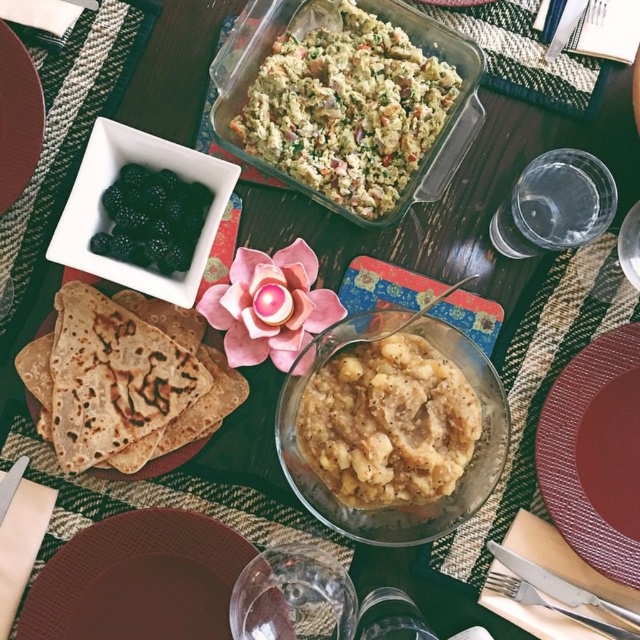
You are a guest at the table and want to reach for the brown matte plate at lower left. Considering your arm can extend 24 inches, can you comfortably reach it without moving your chair?

The brown matte plate at lower left is 18.76 inches from the camera, so yes, you can comfortably reach it since your arm can extend 24 inches, which is longer than the distance to the plate.

You are setting up a table and need to place a decorative item on the maroon plastic plate at lower right. Based on the table layout described, where should you position the plate to ensure it aligns with the existing arrangement?

The maroon plastic plate at lower right should be positioned at point [595,452] to align with the existing table arrangement as described.